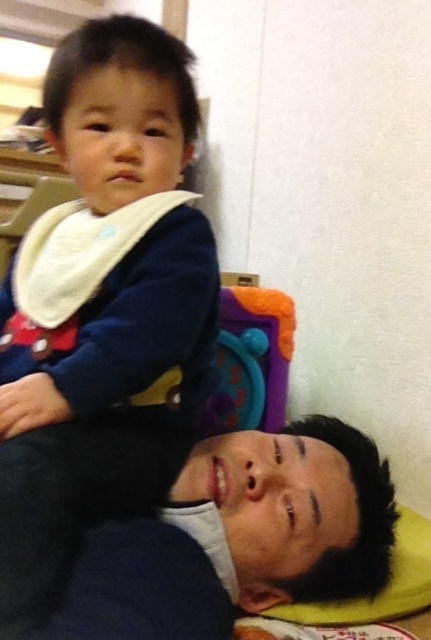
Does black matte shirt at lower left appear on the right side of white soft bib at upper left?

Indeed, black matte shirt at lower left is positioned on the right side of white soft bib at upper left.

This screenshot has width=431, height=640. I want to click on black matte shirt at lower left, so click(187, 529).